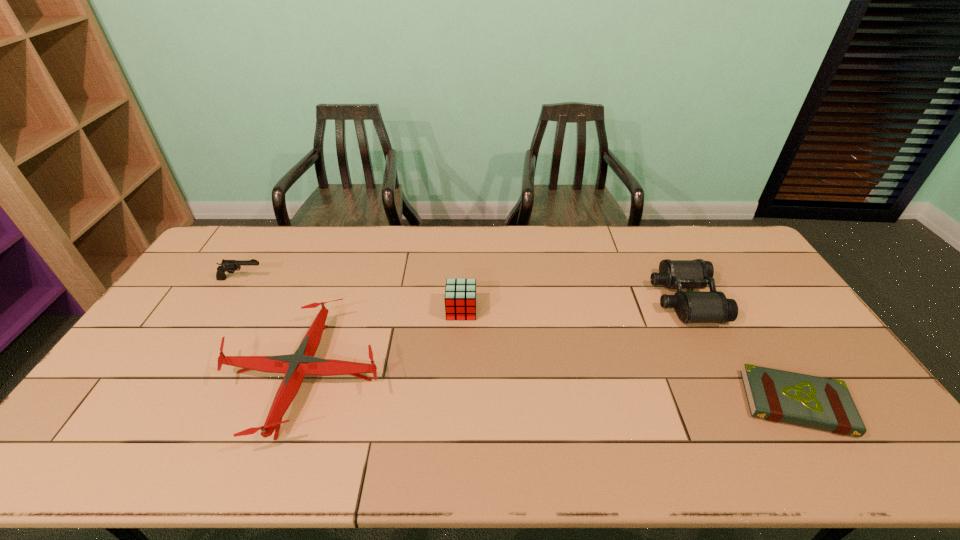
This screenshot has height=540, width=960. What are the coordinates of `the third object from left to right` in the screenshot? It's located at (460, 294).

Where is `binoculars`? This screenshot has height=540, width=960. binoculars is located at coordinates (691, 307).

Find the location of `gun`. gun is located at coordinates (230, 266).

The width and height of the screenshot is (960, 540). In order to click on the fourth object from right to left in this screenshot , I will do (x=295, y=366).

Locate an element on the screen. The height and width of the screenshot is (540, 960). book is located at coordinates (775, 395).

At what (x,y) coordinates should I click in order to perform the action: click on free region located on the right of the cube. Please return your answer as a coordinate pair (x, y). This screenshot has height=540, width=960. Looking at the image, I should click on (598, 310).

This screenshot has width=960, height=540. I want to click on vacant space located 0.370m through the eyepieces of the binoculars, so click(x=540, y=299).

The width and height of the screenshot is (960, 540). I want to click on free space located through the eyepieces of the binoculars, so click(x=545, y=299).

Image resolution: width=960 pixels, height=540 pixels. In order to click on vacant space located through the eyepieces of the binoculars in this screenshot , I will do `click(592, 299)`.

The width and height of the screenshot is (960, 540). I want to click on free space located 0.180m at the end of the barrel of the leftmost object, so click(318, 279).